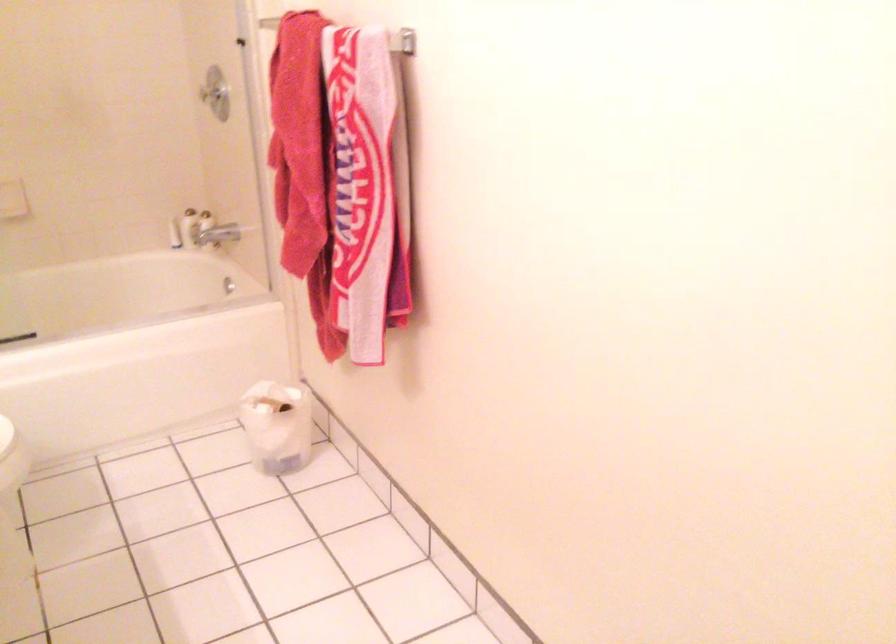
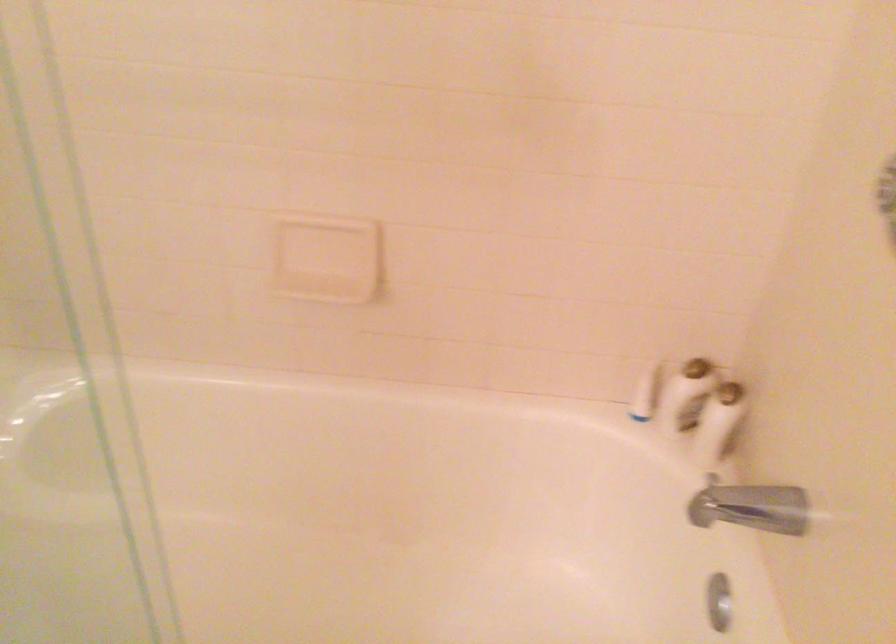
In the second image, find the point that corresponds to point (177, 231) in the first image.

(644, 393)